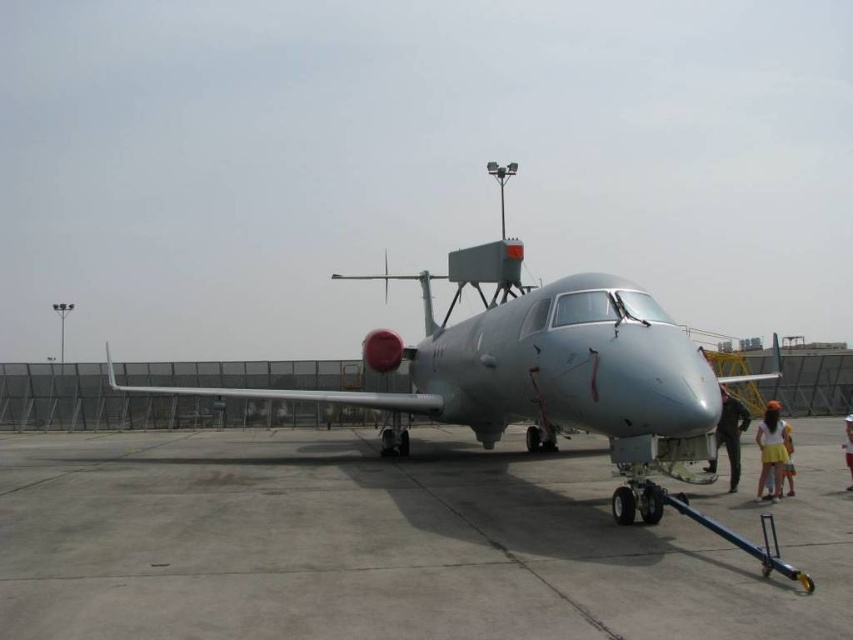
You are standing at a safe distance from the military aircraft. You want to approach the point marked as point (283, 397). Given that the recommended safe distance from the aircraft is 15 meters, will you be able to reach that point without violating the safety guidelines?

The distance of point (283, 397) from viewer is 14.30 meters, which is less than the recommended 15 meters safe distance. Therefore, approaching that point would violate the safety guidelines.

You are a photographer trying to capture the entire scene of the sleek metallic airplane at center and the yellow fabric skirt at lower right in one shot. Based on their sizes, which object should you focus on first to ensure both are in frame?

The sleek metallic airplane at center is larger than the yellow fabric skirt at lower right, so you should focus on the airplane first to ensure both fit in the frame.

You are a pilot standing at the edge of the airfield. You need to walk to the black fabric person at lower right but must avoid walking behind the sleek metallic airplane at center. Is this possible?

The sleek metallic airplane at center is in front of the black fabric person at lower right, so walking around either side of the airplane would allow you to reach the black fabric person at lower right without going behind it.